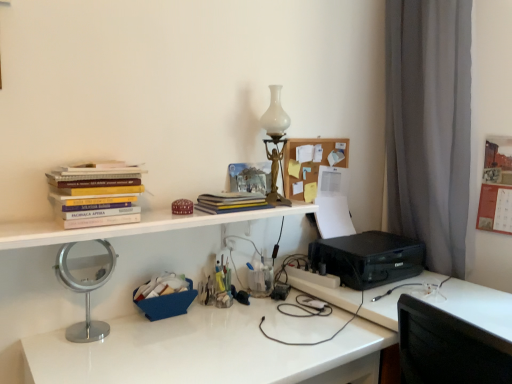
Question: Is yellow matte book at center, the second book viewed from the left, far from black plastic printer at lower right?

Choices:
 (A) no
 (B) yes

Answer: (A)

Question: Does yellow matte book at center, the second book viewed from the left, appear on the left side of black plastic printer at lower right?

Choices:
 (A) yes
 (B) no

Answer: (A)

Question: Is yellow matte book at center, the 1th book from the right, thinner than black plastic printer at lower right?

Choices:
 (A) yes
 (B) no

Answer: (A)

Question: Could you tell me if yellow matte book at center, the second book viewed from the left, is facing black plastic printer at lower right?

Choices:
 (A) yes
 (B) no

Answer: (B)

Question: From a real-world perspective, is yellow matte book at center, the second book viewed from the left, positioned over black plastic printer at lower right based on gravity?

Choices:
 (A) yes
 (B) no

Answer: (A)

Question: From a real-world perspective, is yellow matte book at center, which appears as the 2th book when viewed from the front, located beneath black plastic printer at lower right?

Choices:
 (A) yes
 (B) no

Answer: (B)

Question: Can you see white glossy desk at center touching black plastic printer at lower right?

Choices:
 (A) no
 (B) yes

Answer: (A)

Question: Is white glossy desk at center wider than black plastic printer at lower right?

Choices:
 (A) no
 (B) yes

Answer: (B)

Question: From the image's perspective, would you say white glossy desk at center is positioned over black plastic printer at lower right?

Choices:
 (A) no
 (B) yes

Answer: (A)

Question: Can you confirm if white glossy desk at center is taller than black plastic printer at lower right?

Choices:
 (A) yes
 (B) no

Answer: (A)

Question: Are white glossy desk at center and black plastic printer at lower right located far from each other?

Choices:
 (A) yes
 (B) no

Answer: (B)

Question: Can you confirm if white glossy desk at center is bigger than black plastic printer at lower right?

Choices:
 (A) yes
 (B) no

Answer: (A)

Question: Does black plastic printer at lower right have a greater width compared to black plastic printer at lower right?

Choices:
 (A) yes
 (B) no

Answer: (A)